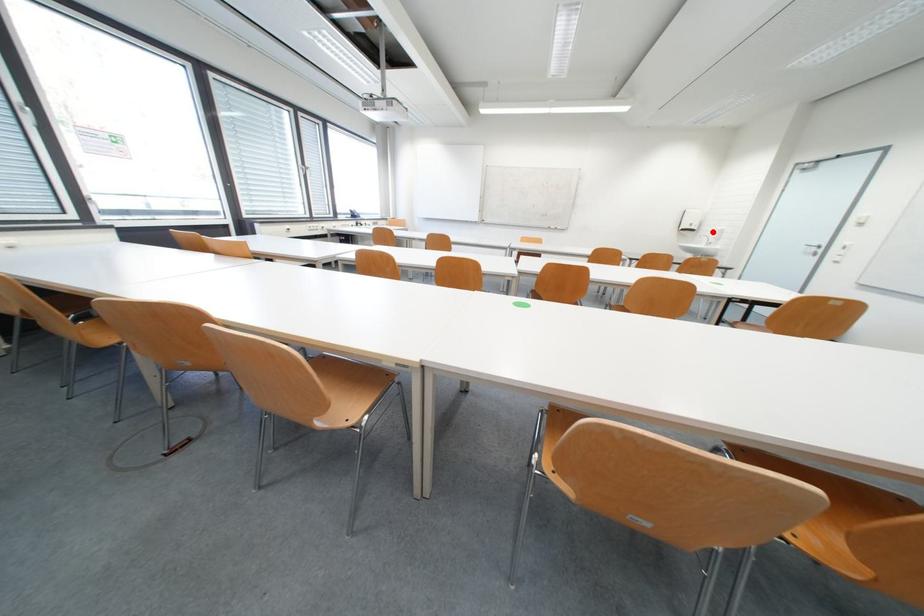
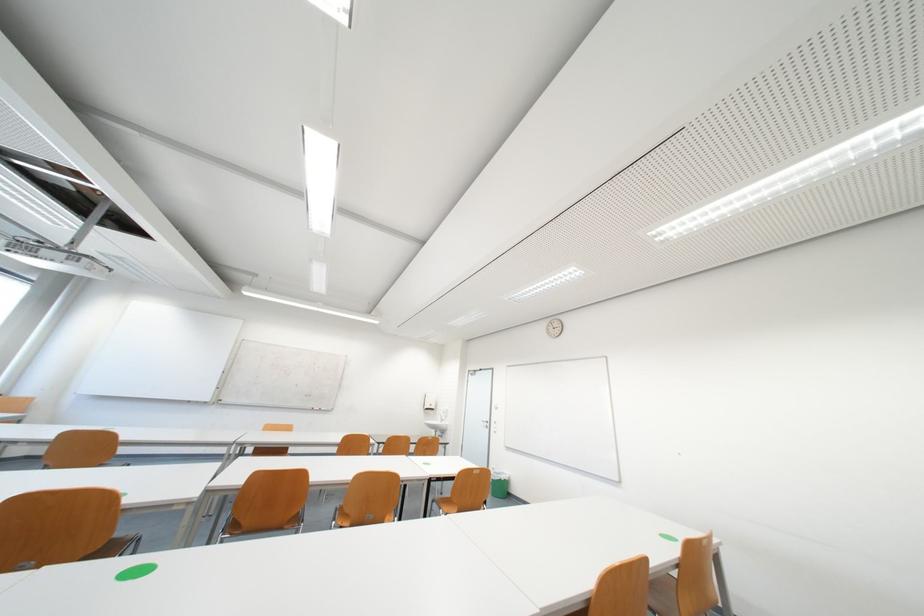
Find the pixel in the second image that matches the highlighted location in the first image.

(445, 411)